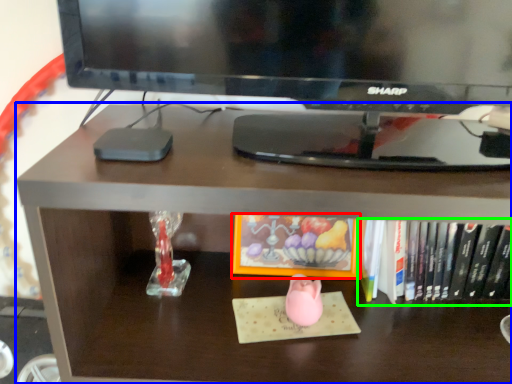
Question: Estimate the real-world distances between objects in this image. Which object is farther from book (highlighted by a red box), desk (highlighted by a blue box) or book (highlighted by a green box)?

Choices:
 (A) desk
 (B) book

Answer: (A)